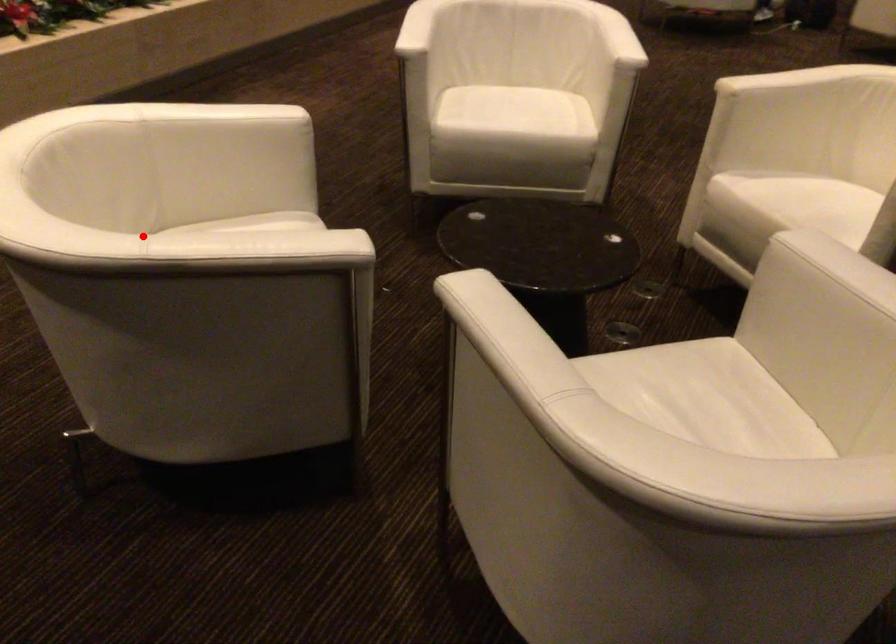
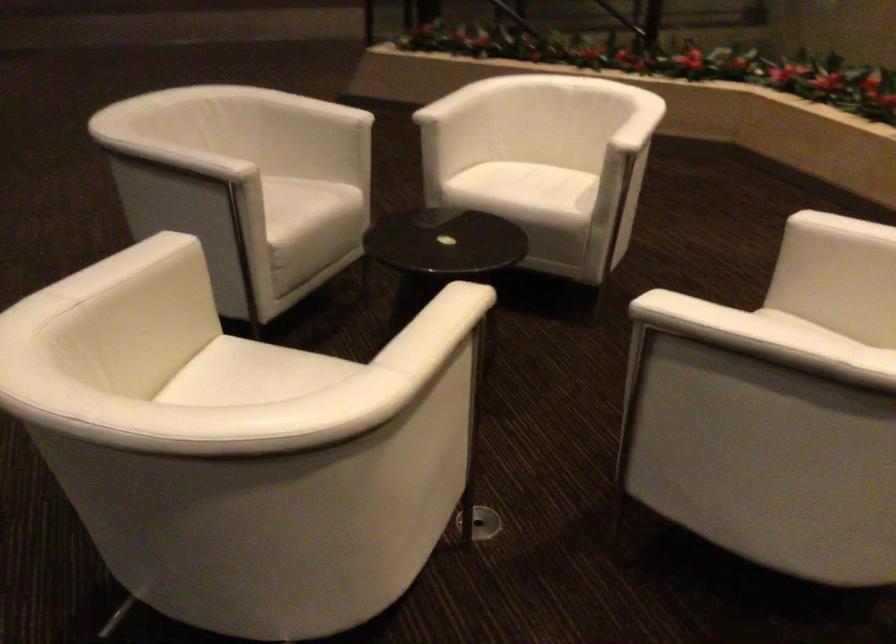
The point at the highlighted location is marked in the first image. Where is the corresponding point in the second image?

(469, 89)